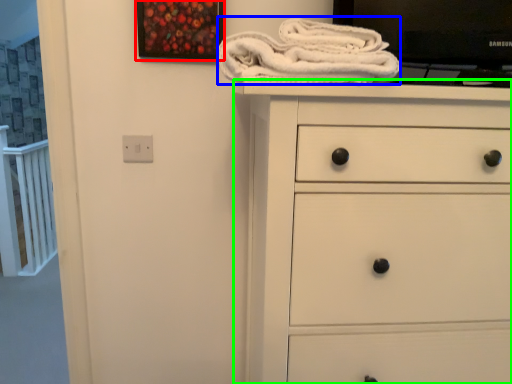
Question: Which object is positioned farthest from picture frame (highlighted by a red box)? Select from bath towel (highlighted by a blue box) and chest of drawers (highlighted by a green box).

Choices:
 (A) bath towel
 (B) chest of drawers

Answer: (B)